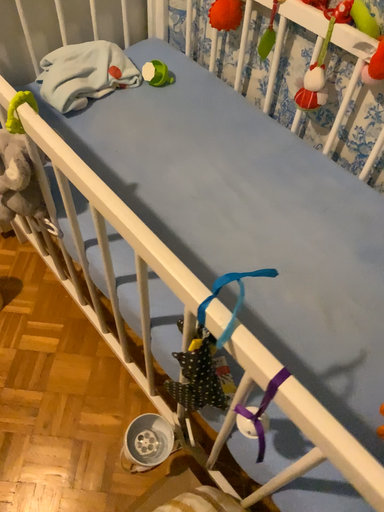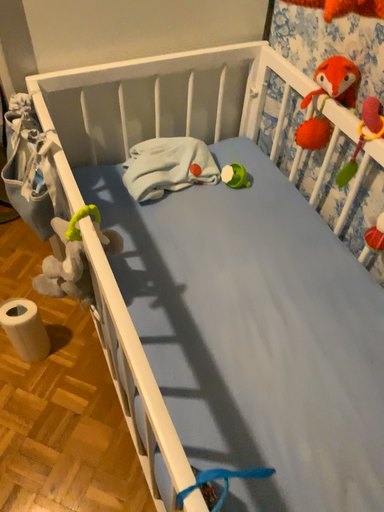
Question: How did the camera likely rotate when shooting the video?

Choices:
 (A) rotated right
 (B) rotated left

Answer: (B)